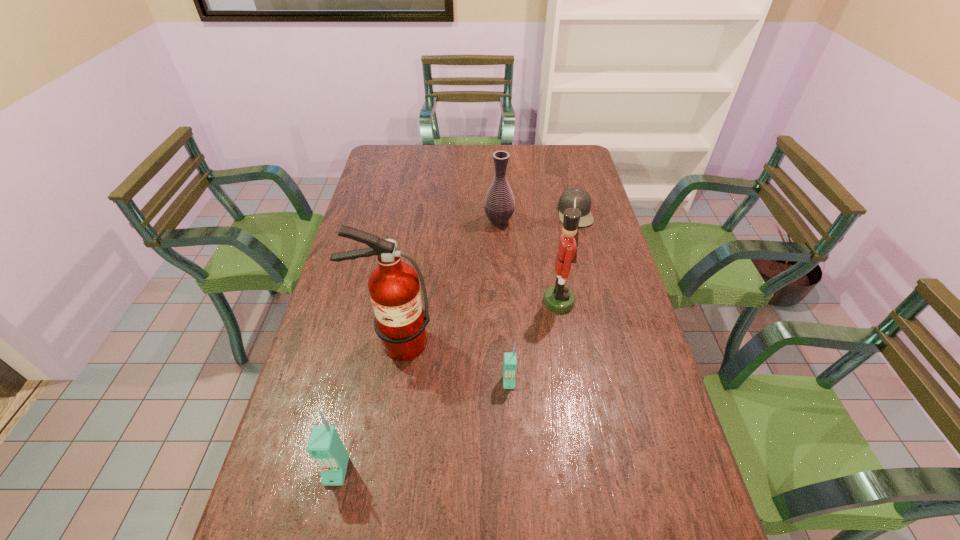
This screenshot has width=960, height=540. Identify the location of fire extinguisher located in the left edge section of the desktop. 400,320.

Find the location of a particular element. The height and width of the screenshot is (540, 960). object present at the right edge is located at coordinates (583, 200).

The width and height of the screenshot is (960, 540). What are the coordinates of `free space at the far edge of the desktop` in the screenshot? It's located at (539, 169).

Where is `free space at the left edge of the desktop`? The width and height of the screenshot is (960, 540). free space at the left edge of the desktop is located at coordinates (354, 279).

Find the location of a particular element. vacant space at the right edge is located at coordinates (604, 325).

In the image, there is a desktop. Where is `vacant region at the near left corner`? This screenshot has width=960, height=540. vacant region at the near left corner is located at coordinates (308, 536).

Locate an element on the screen. The width and height of the screenshot is (960, 540). blank region between the vase and the shorter cellular telephone is located at coordinates (504, 302).

You are a GUI agent. You are given a task and a screenshot of the screen. Output one action in this format:
    pyautogui.click(x=<x>, y=<y>)
    Task: Click on the free spot between the fire extinguisher and the vase
    The width and height of the screenshot is (960, 540).
    Given the screenshot: What is the action you would take?
    point(446,282)

Where is `empty space that is in between the fifth farthest object and the fourth shortest object`? empty space that is in between the fifth farthest object and the fourth shortest object is located at coordinates (504, 302).

You are a GUI agent. You are given a task and a screenshot of the screen. Output one action in this format:
    pyautogui.click(x=<x>, y=<y>)
    Task: Click on the free space that is in between the farther cellular telephone and the taller cellular telephone
    The width and height of the screenshot is (960, 540).
    Given the screenshot: What is the action you would take?
    pyautogui.click(x=422, y=427)